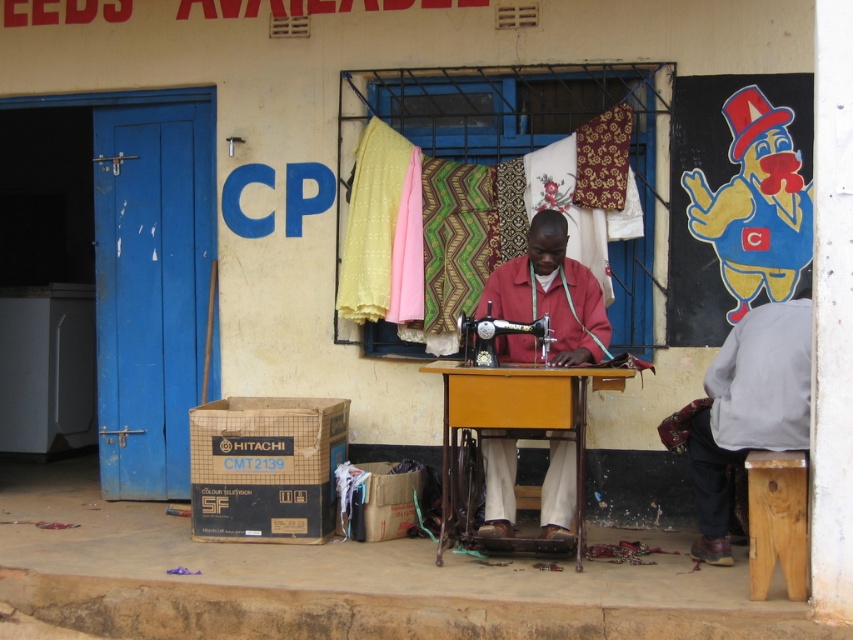
You are a tailor trying to reach the gray fabric at lower right while sitting on the light brown wooden stool at lower right. Can you comfortably reach it without moving your seat?

The distance between the gray fabric at lower right and the light brown wooden stool at lower right is 14.14 inches, so yes, you can comfortably reach it while sitting on the stool.

You are a visitor approaching the sewing workshop from the front. You see the gray fabric at lower right and the light brown wooden stool at lower right. Which object is closer to you?

The gray fabric at lower right is closer to you because the light brown wooden stool at lower right is behind it.

You are a customer observing the sewing workshop. You notice the gray fabric at lower right and the red matte sewing machine at center. Which object is wider?

The gray fabric at lower right has a lesser width compared to the red matte sewing machine at center, so the red matte sewing machine at center is wider.